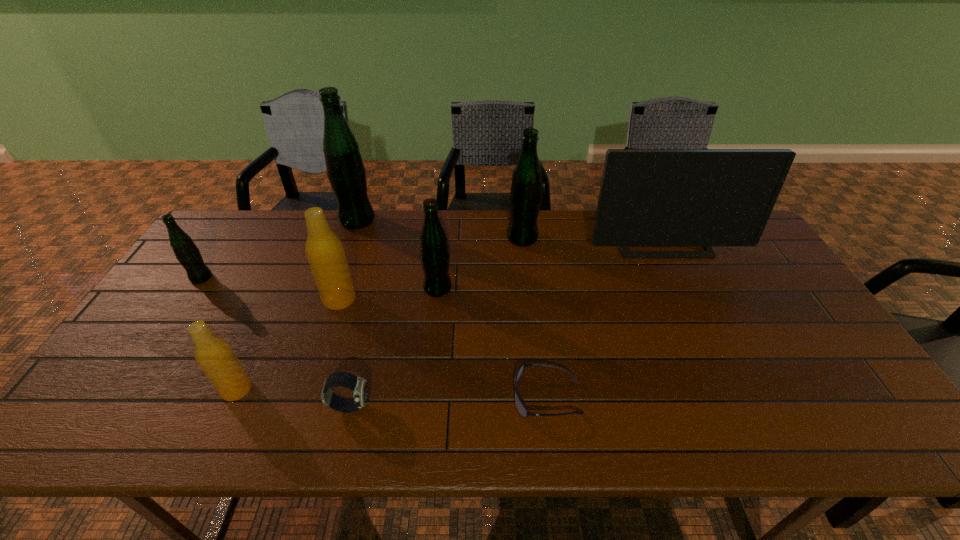
This screenshot has height=540, width=960. I want to click on free region located on the left of the second smallest green beer bottle, so click(x=379, y=288).

Locate an element on the screen. vacant area located 0.270m on the right of the bigger tan beer bottle is located at coordinates (450, 299).

Locate an element on the screen. blank space located on the back of the leftmost object is located at coordinates (246, 213).

This screenshot has width=960, height=540. What are the coordinates of `vacant space located 0.170m on the back of the left tan beer bottle` in the screenshot? It's located at click(x=267, y=323).

This screenshot has height=540, width=960. Identify the location of vacant area situated 0.250m on the face of the watch. (479, 406).

Find the location of a particular element. This screenshot has width=960, height=540. vacant area situated on the lenses of the sunglasses is located at coordinates pyautogui.click(x=423, y=397).

What are the coordinates of `vacant space situated on the lenses of the sunglasses` in the screenshot? It's located at [458, 397].

Locate an element on the screen. vacant region located on the lenses of the sunglasses is located at coordinates (458, 397).

Find the location of a particular element. This screenshot has height=540, width=960. computer monitor that is at the far edge is located at coordinates 648,197.

This screenshot has width=960, height=540. In order to click on watch that is positioned at the near edge in this screenshot , I will do `click(359, 386)`.